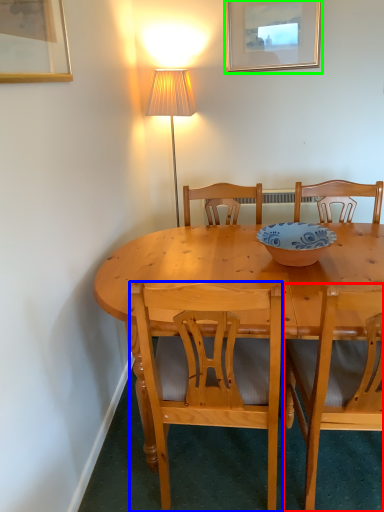
Question: Estimate the real-world distances between objects in this image. Which object is farther from chair (highlighted by a red box), chair (highlighted by a blue box) or picture frame (highlighted by a green box)?

Choices:
 (A) chair
 (B) picture frame

Answer: (B)